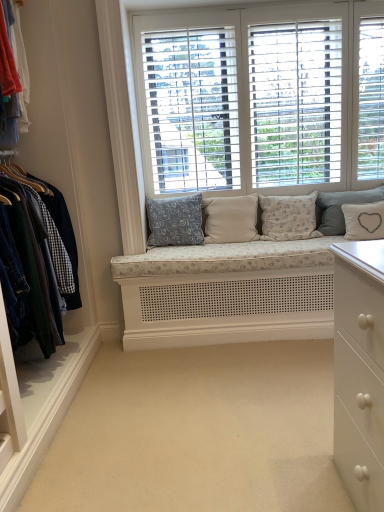
Question: Is denim jacket at left to the left of white fabric pillow with heart design at center, which ranks as the 5th pillow in left-to-right order, from the viewer's perspective?

Choices:
 (A) no
 (B) yes

Answer: (B)

Question: From a real-world perspective, does denim jacket at left stand above white fabric pillow with heart design at center, which ranks as the 1th pillow in right-to-left order?

Choices:
 (A) no
 (B) yes

Answer: (B)

Question: Does denim jacket at left have a smaller size compared to white fabric pillow with heart design at center, which ranks as the 5th pillow in left-to-right order?

Choices:
 (A) yes
 (B) no

Answer: (B)

Question: From the image's perspective, is denim jacket at left over white fabric pillow with heart design at center, which ranks as the 1th pillow in right-to-left order?

Choices:
 (A) no
 (B) yes

Answer: (A)

Question: Considering the relative sizes of denim jacket at left and white fabric pillow with heart design at center, which ranks as the 5th pillow in left-to-right order, in the image provided, is denim jacket at left thinner than white fabric pillow with heart design at center, which ranks as the 5th pillow in left-to-right order,?

Choices:
 (A) no
 (B) yes

Answer: (A)

Question: In terms of width, does white fabric pillow with heart design at center, which ranks as the 1th pillow in right-to-left order, look wider or thinner when compared to blue floral fabric pillow at center, the 1th pillow viewed from the left?

Choices:
 (A) wide
 (B) thin

Answer: (B)

Question: Is white fabric pillow with heart design at center, which ranks as the 1th pillow in right-to-left order, bigger or smaller than blue floral fabric pillow at center, the 1th pillow viewed from the left?

Choices:
 (A) big
 (B) small

Answer: (B)

Question: Considering the positions of white fabric pillow with heart design at center, which ranks as the 5th pillow in left-to-right order, and blue floral fabric pillow at center, the 1th pillow viewed from the left, in the image, is white fabric pillow with heart design at center, which ranks as the 5th pillow in left-to-right order, taller or shorter than blue floral fabric pillow at center, the 1th pillow viewed from the left,?

Choices:
 (A) tall
 (B) short

Answer: (B)

Question: From a real-world perspective, is white fabric pillow with heart design at center, which ranks as the 1th pillow in right-to-left order, above or below blue floral fabric pillow at center, the 1th pillow viewed from the left?

Choices:
 (A) above
 (B) below

Answer: (B)

Question: Is blue floral fabric pillow at center, the 1th pillow viewed from the left, spatially inside denim jacket at left, or outside of it?

Choices:
 (A) inside
 (B) outside

Answer: (B)

Question: Considering the positions of point (165, 203) and point (34, 218), is point (165, 203) closer or farther from the camera than point (34, 218)?

Choices:
 (A) closer
 (B) farther

Answer: (B)

Question: From the image's perspective, relative to denim jacket at left, is blue floral fabric pillow at center, the 1th pillow viewed from the left, above or below?

Choices:
 (A) above
 (B) below

Answer: (A)

Question: Considering the positions of blue floral fabric pillow at center, which appears as the fifth pillow when viewed from the right, and denim jacket at left in the image, is blue floral fabric pillow at center, which appears as the fifth pillow when viewed from the right, taller or shorter than denim jacket at left?

Choices:
 (A) tall
 (B) short

Answer: (B)

Question: In terms of height, does fluffy white pillow at center, the 3th pillow in the left-to-right sequence, look taller or shorter compared to white wood window at center?

Choices:
 (A) tall
 (B) short

Answer: (B)

Question: From a real-world perspective, is fluffy white pillow at center, positioned as the 3th pillow in right-to-left order, physically located above or below white wood window at center?

Choices:
 (A) above
 (B) below

Answer: (B)